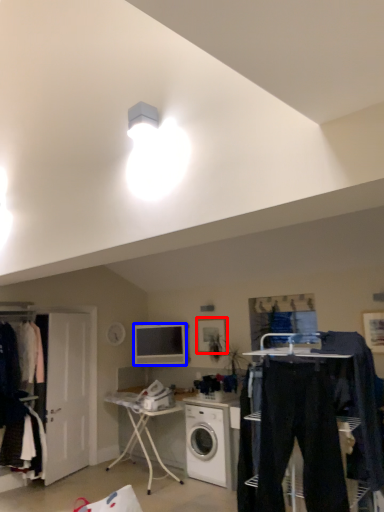
Question: Which point is closer to the camera, picture frame (highlighted by a red box) or television (highlighted by a blue box)?

Choices:
 (A) picture frame
 (B) television

Answer: (A)